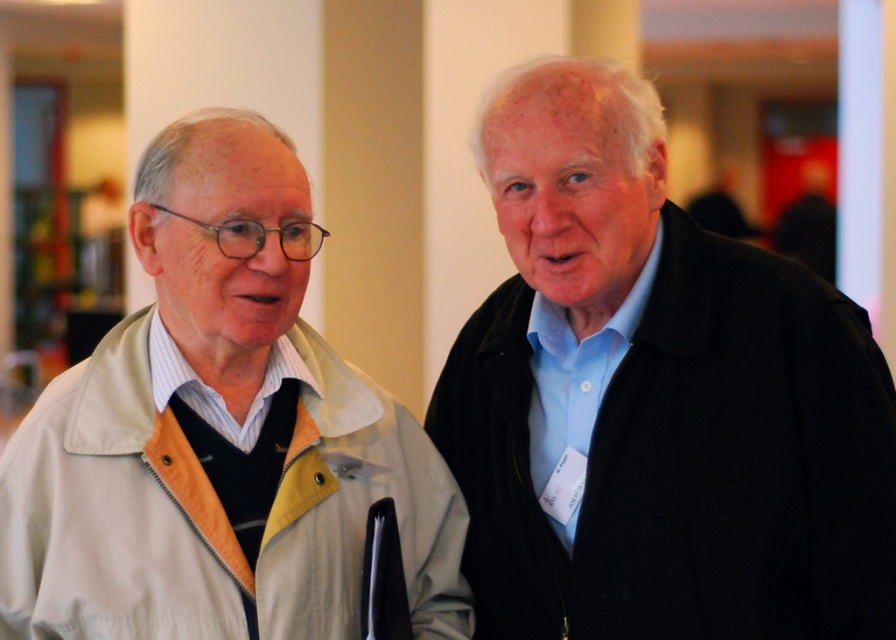
Question: Where is light beige jacket at left located in relation to black woolen coat at right in the image?

Choices:
 (A) left
 (B) right

Answer: (A)

Question: Which of the following is the farthest from the observer?

Choices:
 (A) (445, 449)
 (B) (410, 417)

Answer: (A)

Question: Can you confirm if light beige jacket at left is smaller than black woolen coat at right?

Choices:
 (A) yes
 (B) no

Answer: (A)

Question: Among these objects, which one is farthest from the camera?

Choices:
 (A) light beige jacket at left
 (B) black woolen coat at right

Answer: (B)

Question: Which object is closer to the camera taking this photo?

Choices:
 (A) light beige jacket at left
 (B) black woolen coat at right

Answer: (A)

Question: Can you confirm if light beige jacket at left is smaller than black woolen coat at right?

Choices:
 (A) no
 (B) yes

Answer: (B)